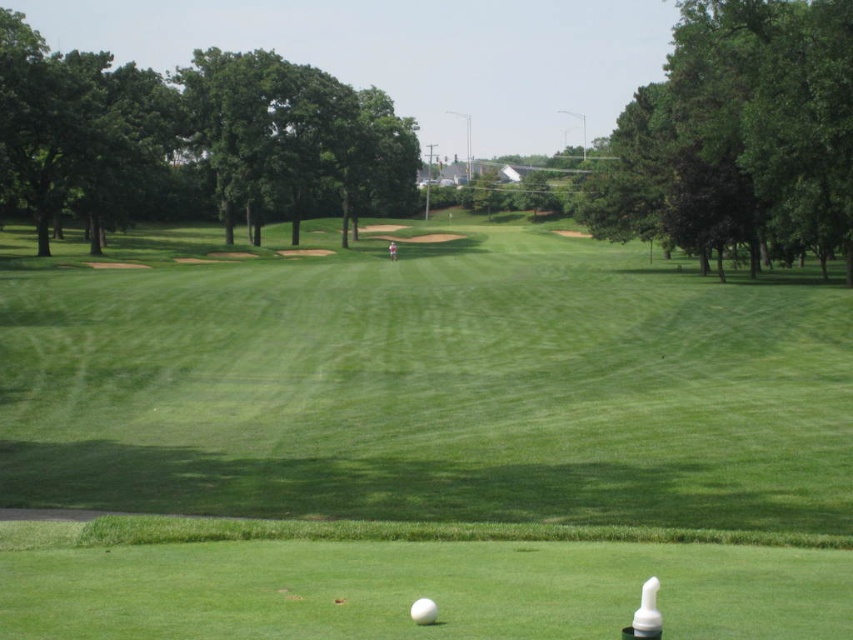
Looking at this image, you are a golfer standing at the tee box and see the green grassy field at center and the white matte golf ball at center. Which object is wider?

The green grassy field at center is wider than the white matte golf ball at center according to the description.

You are standing at the point marked as point [422,444] on the golf course. What is the immediate terrain you are standing on?

The immediate terrain at point [422,444] is a green grassy field at center.